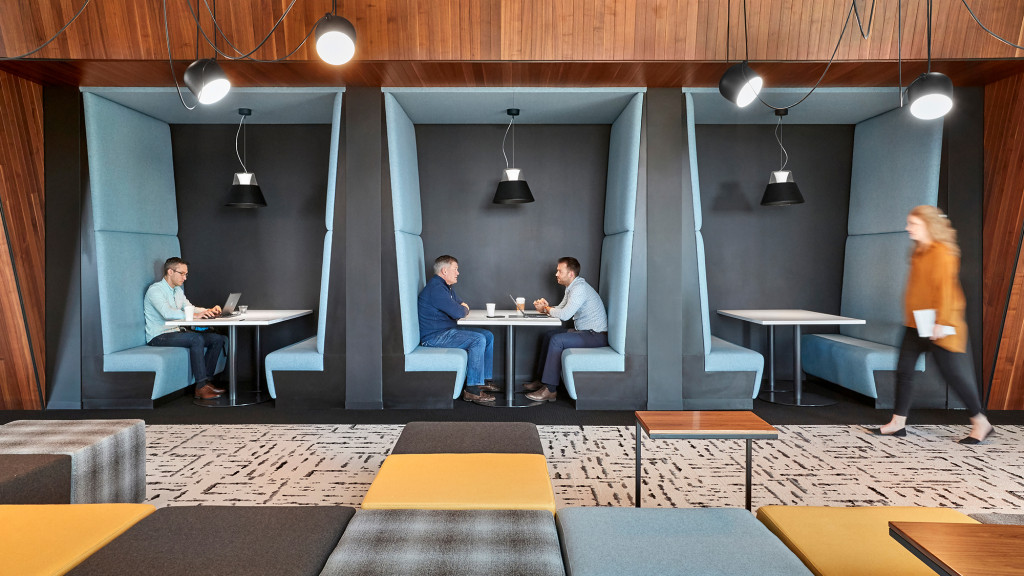
The image size is (1024, 576). Identify the location of booth seating. (869, 348).